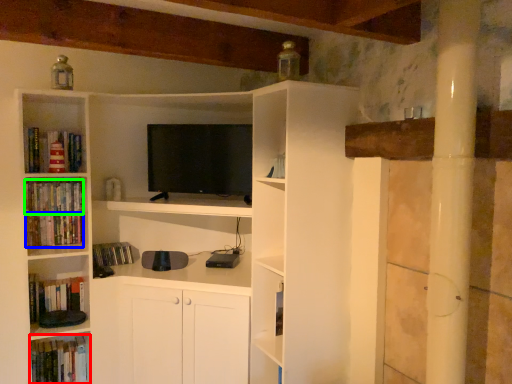
Question: Which object is the closest to the book (highlighted by a red box)? Choose among these: book (highlighted by a blue box) or book (highlighted by a green box).

Choices:
 (A) book
 (B) book

Answer: (A)